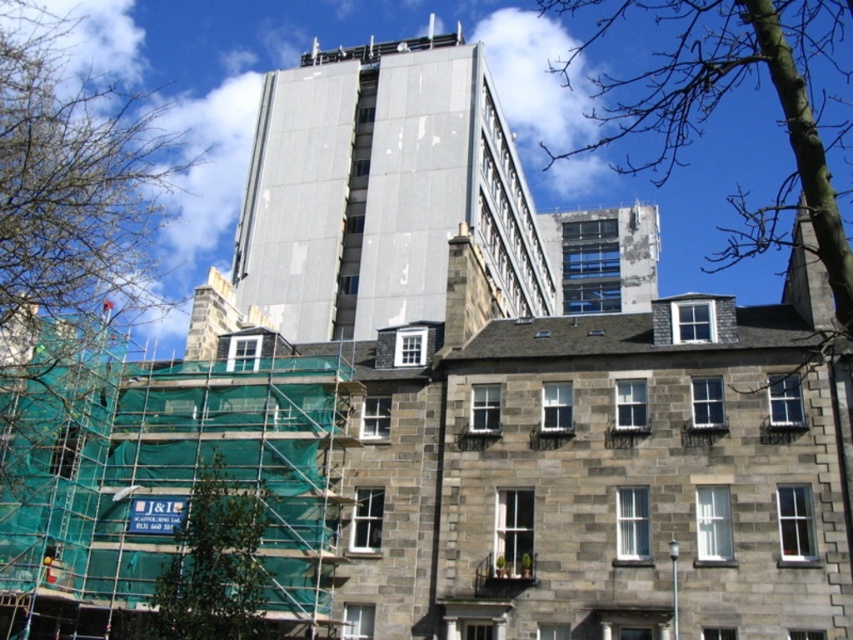
You are an urban planner assessing the greenery distribution in the image. Which tree, the green leafy tree at left or the bare wood tree at upper right, takes up more space in the scene?

The bare wood tree at upper right takes up more space than the green leafy tree at left.

You are standing in front of the traditional stone building and want to reach the modern highrise construction site. You see two points marked on the ground, point [302,61] and point [111,204]. Which point is closer to you?

Point [302,61] is further to the viewer than point [111,204], so the closer point to you is point [111,204].